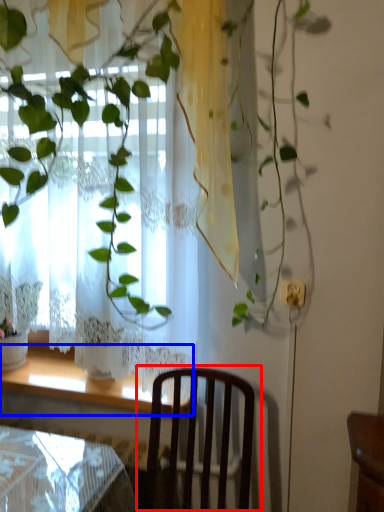
Question: Which of the following is the closest to the observer, chair (highlighted by a red box) or window sill (highlighted by a blue box)?

Choices:
 (A) chair
 (B) window sill

Answer: (A)